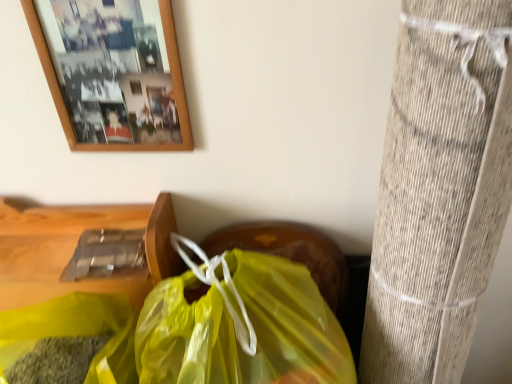
Question: Is translucent yellow plastic bag at lower center inside or outside of wooden picture frame at upper left?

Choices:
 (A) inside
 (B) outside

Answer: (B)

Question: Considering the positions of translucent yellow plastic bag at lower center and wooden picture frame at upper left in the image, is translucent yellow plastic bag at lower center wider or thinner than wooden picture frame at upper left?

Choices:
 (A) wide
 (B) thin

Answer: (A)

Question: Considering their positions, is translucent yellow plastic bag at lower center located in front of or behind wooden picture frame at upper left?

Choices:
 (A) behind
 (B) front

Answer: (B)

Question: From a real-world perspective, is wooden picture frame at upper left physically located above or below translucent yellow plastic bag at lower center?

Choices:
 (A) below
 (B) above

Answer: (B)

Question: Considering their positions, is wooden picture frame at upper left located in front of or behind translucent yellow plastic bag at lower center?

Choices:
 (A) front
 (B) behind

Answer: (B)

Question: Does point (133, 26) appear closer or farther from the camera than point (305, 380)?

Choices:
 (A) farther
 (B) closer

Answer: (A)

Question: From the image's perspective, is wooden picture frame at upper left located above or below translucent yellow plastic bag at lower center?

Choices:
 (A) below
 (B) above

Answer: (B)